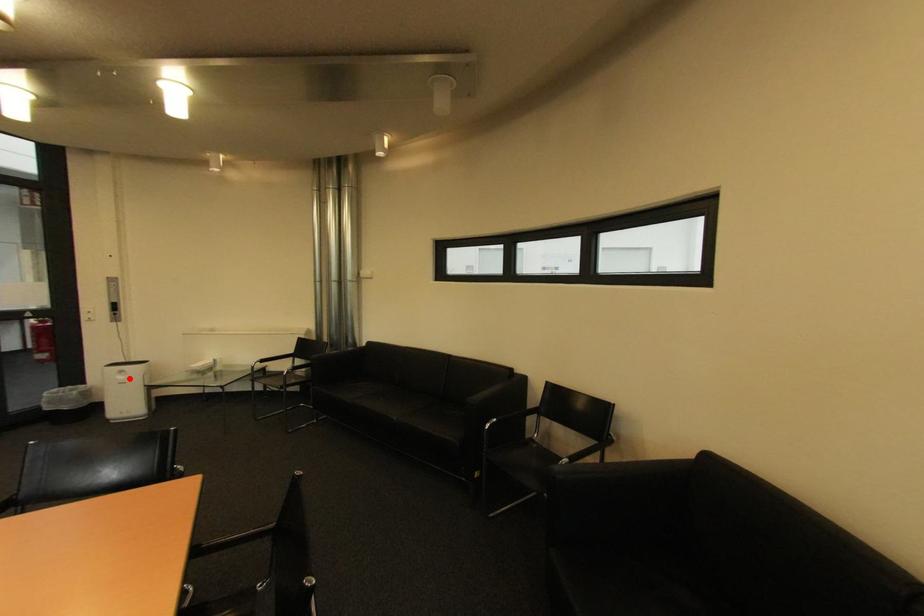
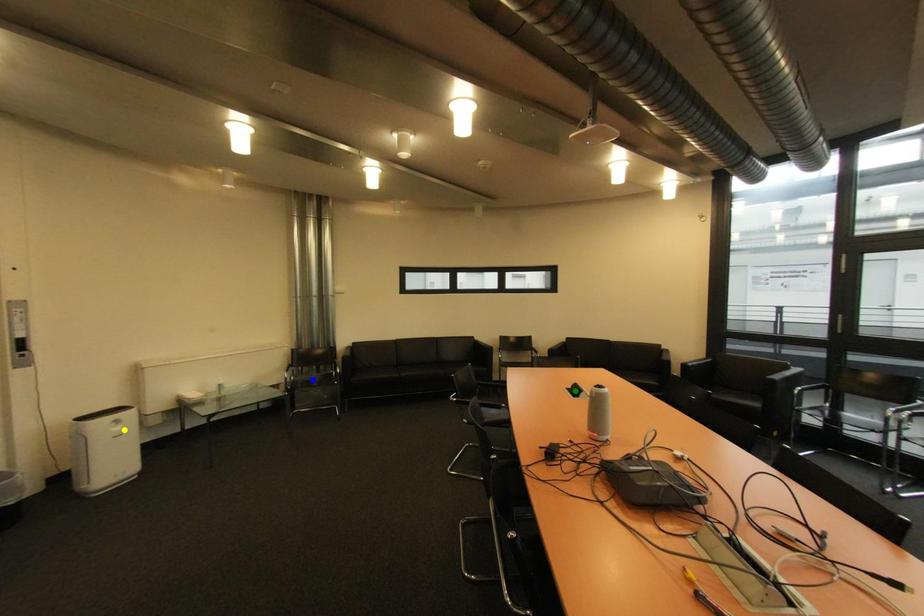
Question: I am providing you with two images of the same scene from different viewpoints. A red point is marked on the first image. You are given multiple points on the second image. Which spot in image 2 lines up with the point in image 1?

Choices:
 (A) blue point
 (B) yellow point
 (C) green point

Answer: (B)